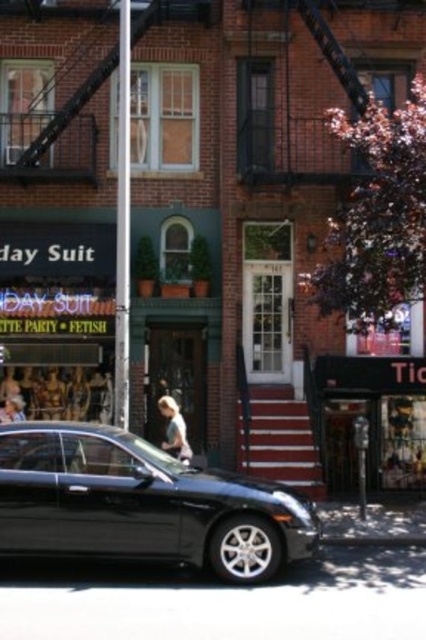
Question: Which point is closer to the camera?

Choices:
 (A) (173, 397)
 (B) (368, 481)
 (C) (285, 502)
 (D) (339, 538)

Answer: (C)

Question: Estimate the real-world distances between objects in this image. Which object is farther from the shiny black sedan at lower left?

Choices:
 (A) metallic gray curb at lower center
 (B) black matte sign at lower right

Answer: (B)

Question: Does shiny black sedan at lower left lie in front of metallic gray curb at lower center?

Choices:
 (A) yes
 (B) no

Answer: (A)

Question: Can you confirm if shiny black sedan at lower left is bigger than black matte sign at lower right?

Choices:
 (A) yes
 (B) no

Answer: (B)

Question: Which object appears farthest from the camera in this image?

Choices:
 (A) shiny black sedan at lower left
 (B) metallic gray curb at lower center
 (C) black matte sign at lower right

Answer: (C)

Question: Does shiny black sedan at lower left have a smaller size compared to metallic gray curb at lower center?

Choices:
 (A) no
 (B) yes

Answer: (A)